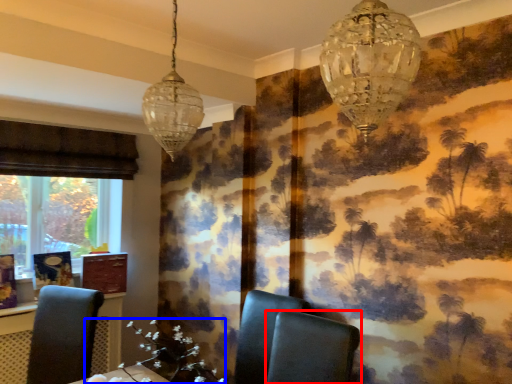
Question: Among these objects, which one is farthest to the camera, chair (highlighted by a red box) or flower (highlighted by a blue box)?

Choices:
 (A) chair
 (B) flower

Answer: (B)